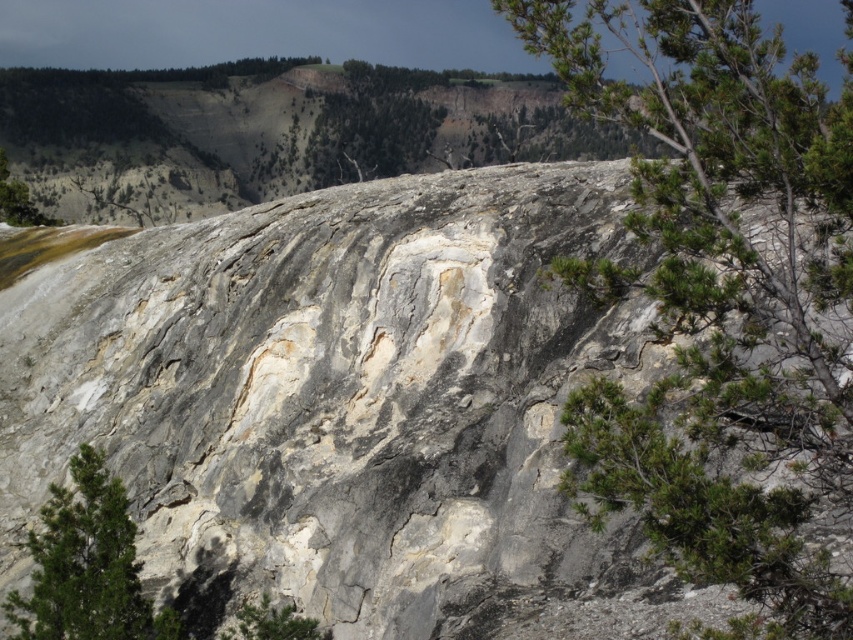
Is point (648, 424) positioned before point (71, 628)?

Yes, it is in front of point (71, 628).

Between green needle-like leaves at upper right and green textured rock at lower left, which one is positioned lower?

green textured rock at lower left is lower down.

Is point (572, 477) behind point (114, 486)?

No, it is in front of (114, 486).

What are the coordinates of `green needle-like leaves at upper right` in the screenshot? It's located at (722, 300).